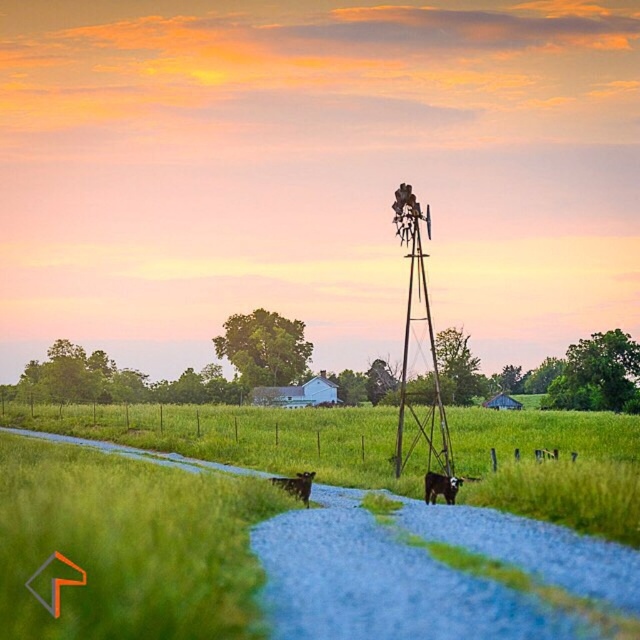
Question: Which point is closer to the camera?

Choices:
 (A) black glossy cow at center
 (B) green grass at center

Answer: (B)

Question: Can you confirm if green grass at center is positioned to the right of black glossy cow at center?

Choices:
 (A) no
 (B) yes

Answer: (A)

Question: Where is rusty metal windmill at center located in relation to brown furry dog at center in the image?

Choices:
 (A) below
 (B) above

Answer: (B)

Question: Can you confirm if green grass at center is wider than black glossy cow at center?

Choices:
 (A) yes
 (B) no

Answer: (A)

Question: Which point is farther to the camera?

Choices:
 (A) green grass at center
 (B) rusty metal windmill at center
 (C) brown furry dog at center
 (D) black glossy cow at center

Answer: (B)

Question: Which point is closer to the camera taking this photo?

Choices:
 (A) (438, 476)
 (B) (291, 429)
 (C) (410, 225)
 (D) (308, 477)

Answer: (A)